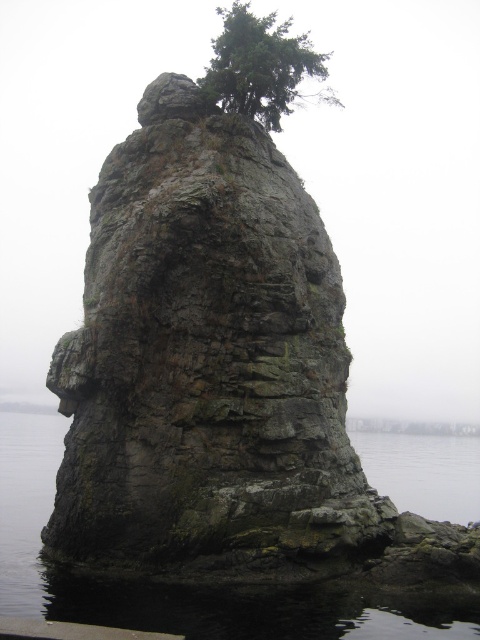
Can you confirm if gray rough rock at center is taller than green rough textured tree at upper center?

No, gray rough rock at center is not taller than green rough textured tree at upper center.

Can you confirm if gray rough rock at center is bigger than green rough textured tree at upper center?

No, gray rough rock at center is not bigger than green rough textured tree at upper center.

Is point (78, 493) less distant than point (292, 51)?

Yes, point (78, 493) is in front of point (292, 51).

This screenshot has width=480, height=640. Find the location of `gray rough rock at center`. gray rough rock at center is located at coordinates (207, 364).

Can you confirm if green rough textured tree at upper center is positioned below transparent water at lower right?

No, green rough textured tree at upper center is not below transparent water at lower right.

Between green rough textured tree at upper center and transparent water at lower right, which one is positioned lower?

Positioned lower is transparent water at lower right.

Does point (261, 42) lie in front of point (415, 435)?

Yes, it is in front of point (415, 435).

Identify the location of green rough textured tree at upper center. (262, 67).

From the picture: Does gray rough rock at center have a greater width compared to dark gray water at lower center?

In fact, gray rough rock at center might be narrower than dark gray water at lower center.

Who is more forward, (191, 212) or (170, 595)?

Point (170, 595) is in front.

Where is `gray rough rock at center`? The width and height of the screenshot is (480, 640). gray rough rock at center is located at coordinates (207, 364).